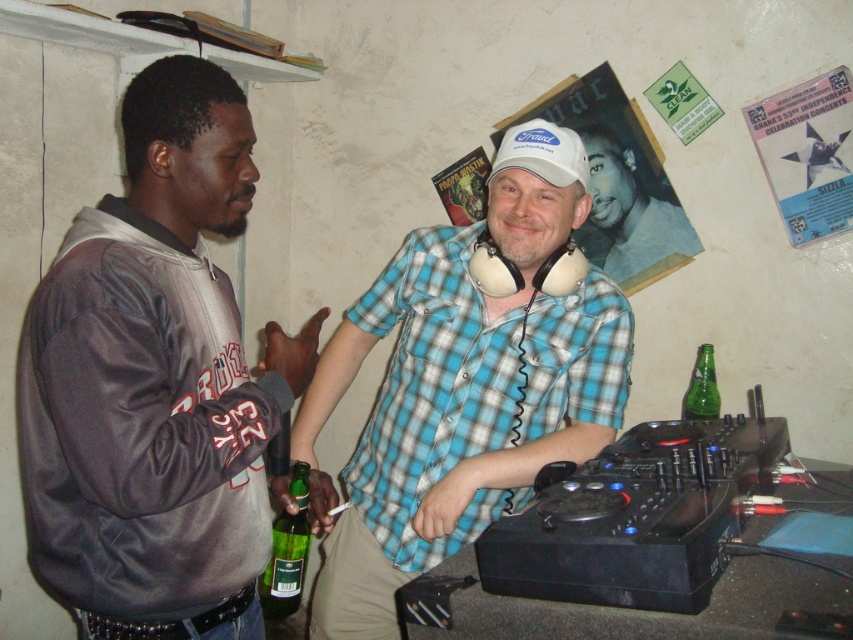
Looking at this image, you are a photographer setting up a shot of the blue plaid shirt at center and the green glass bottle at lower center. To ensure both subjects are in focus, you need to know which one is taller. Which object is taller?

The blue plaid shirt at center is taller than the green glass bottle at lower center according to the description.

You are a delivery person who needs to pack the gray leather jacket at left and the green glass bottle at lower center into a box. The box can only hold items where the larger item is placed underneath the smaller one. Can you do this?

The gray leather jacket at left is bigger than the green glass bottle at lower center. Since the box requires the larger item to be placed underneath the smaller one, you can place the gray leather jacket at left at the bottom and the green glass bottle at lower center on top, so yes, you can do this.